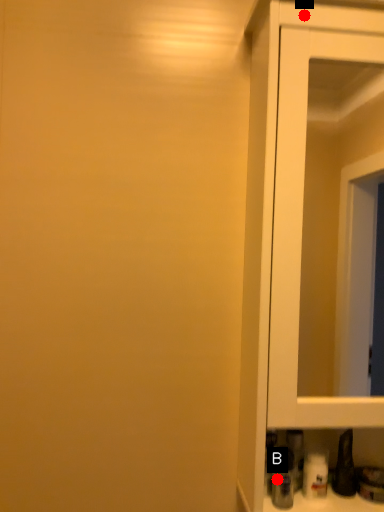
Question: Two points are circled on the image, labeled by A and B beside each circle. Among these points, which one is farthest from the camera?

Choices:
 (A) A is further
 (B) B is further

Answer: (B)